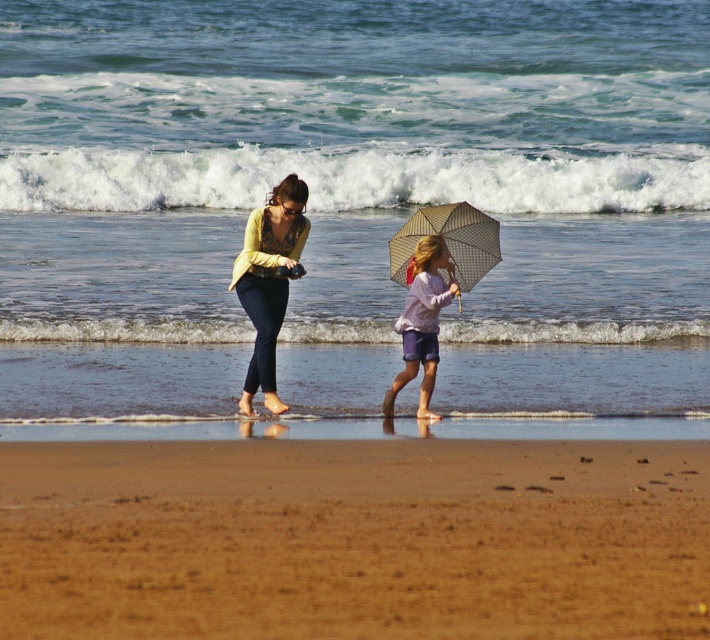
Is matte yellow sweater at center closer to camera compared to light purple fabric umbrella at center?

Yes.

Who is positioned more to the right, matte yellow sweater at center or light purple fabric umbrella at center?

light purple fabric umbrella at center is more to the right.

Which is behind, point (273, 340) or point (457, 285)?

Point (457, 285)

Where is `matte yellow sweater at center`? The width and height of the screenshot is (710, 640). matte yellow sweater at center is located at coordinates (268, 282).

Between brown sandy beach at lower center and checkered fabric umbrella at center, which one appears on the right side from the viewer's perspective?

Positioned to the right is checkered fabric umbrella at center.

Who is positioned more to the left, brown sandy beach at lower center or checkered fabric umbrella at center?

Positioned to the left is brown sandy beach at lower center.

Is point (474, 520) closer to viewer compared to point (439, 228)?

Yes, point (474, 520) is closer to viewer.

Where is `brown sandy beach at lower center`? brown sandy beach at lower center is located at coordinates (355, 538).

How far apart are light purple fabric umbrella at center and checkered fabric umbrella at center?

18.49 inches

I want to click on light purple fabric umbrella at center, so click(422, 321).